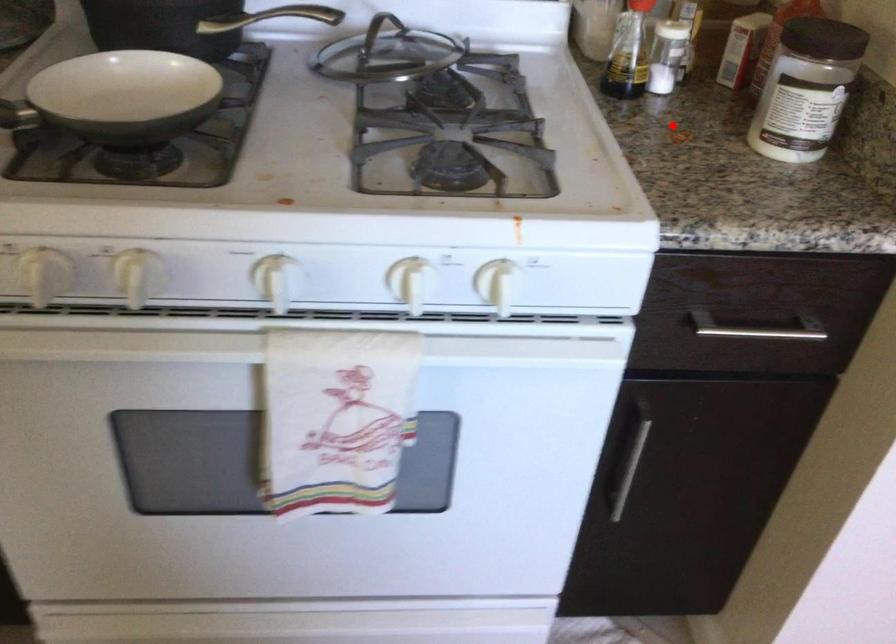
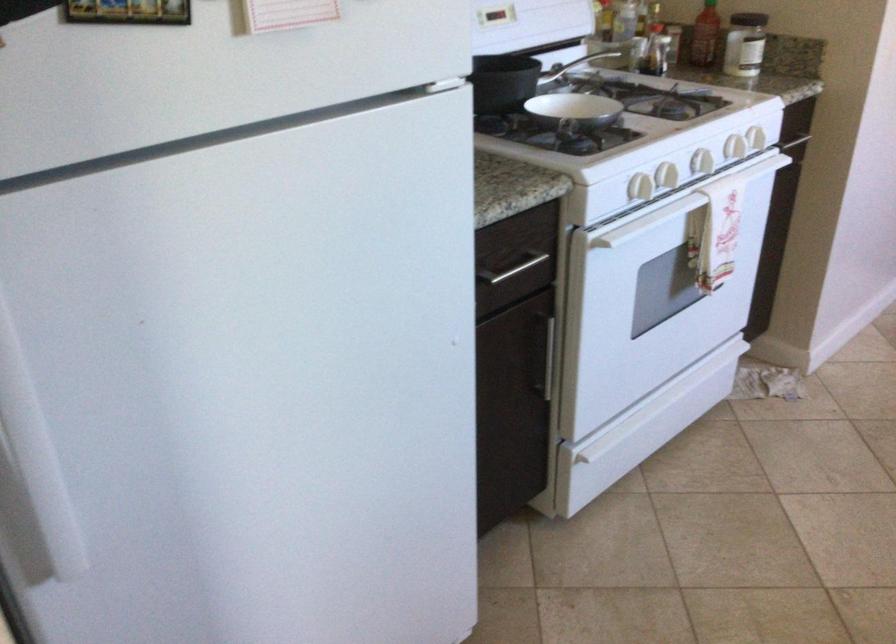
Question: I am providing you with two images of the same scene from different viewpoints. In image1, a red point is highlighted. Considering the same 3D point in image2, which of the following is correct?

Choices:
 (A) It is closer
 (B) It is farther

Answer: (B)